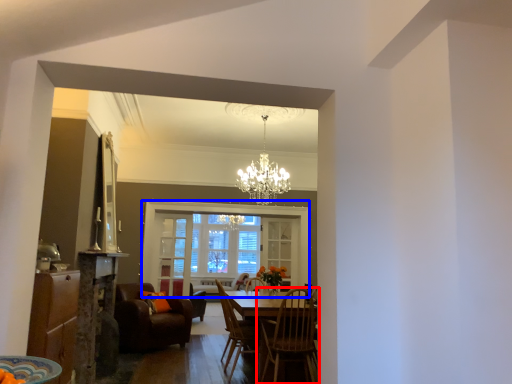
Question: Among these objects, which one is nearest to the camera, chair (highlighted by a red box) or window (highlighted by a blue box)?

Choices:
 (A) chair
 (B) window

Answer: (A)